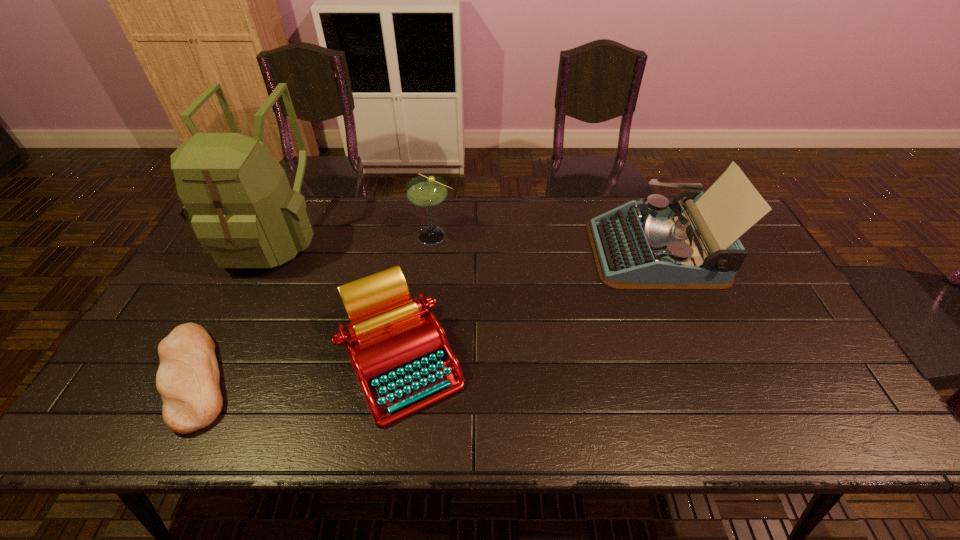
Where is `free space located on the typing side of the right typewriter`? free space located on the typing side of the right typewriter is located at coordinates (468, 251).

I want to click on free space located on the front of the martini, so click(423, 337).

The image size is (960, 540). I want to click on vacant position located 0.060m on the back of the shortest object, so click(x=228, y=312).

Locate an element on the screen. backpack that is positioned at the far edge is located at coordinates pos(237,199).

Identify the location of typewriter that is at the far edge. This screenshot has width=960, height=540. (655, 245).

Where is `martini that is at the far edge`? Image resolution: width=960 pixels, height=540 pixels. martini that is at the far edge is located at coordinates (425, 191).

The image size is (960, 540). I want to click on typewriter situated at the near edge, so click(x=398, y=349).

Find the location of a particular element. bread positioned at the near edge is located at coordinates (188, 377).

What are the coordinates of `backpack at the left edge` in the screenshot? It's located at (237, 199).

Locate an element on the screen. This screenshot has width=960, height=540. bread situated at the left edge is located at coordinates (188, 377).